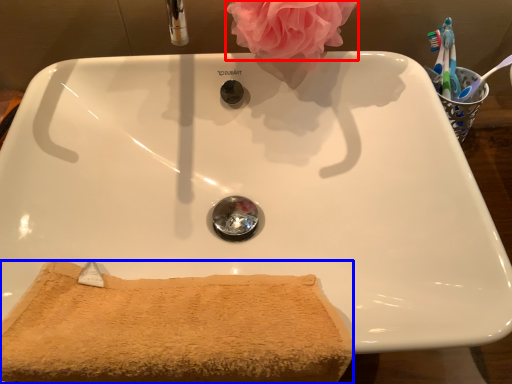
Question: Which of the following is the farthest to the observer, rose (highlighted by a red box) or bath towel (highlighted by a blue box)?

Choices:
 (A) rose
 (B) bath towel

Answer: (A)